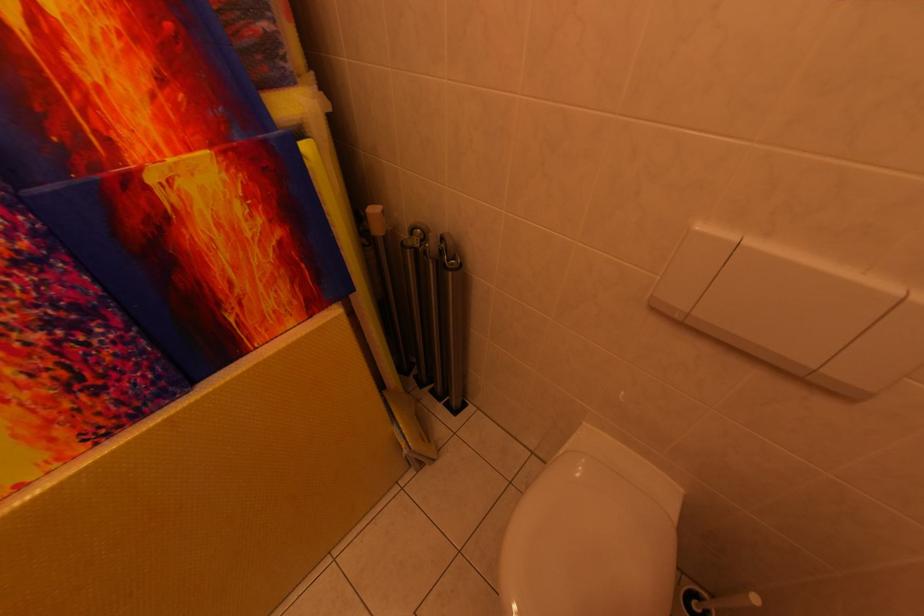
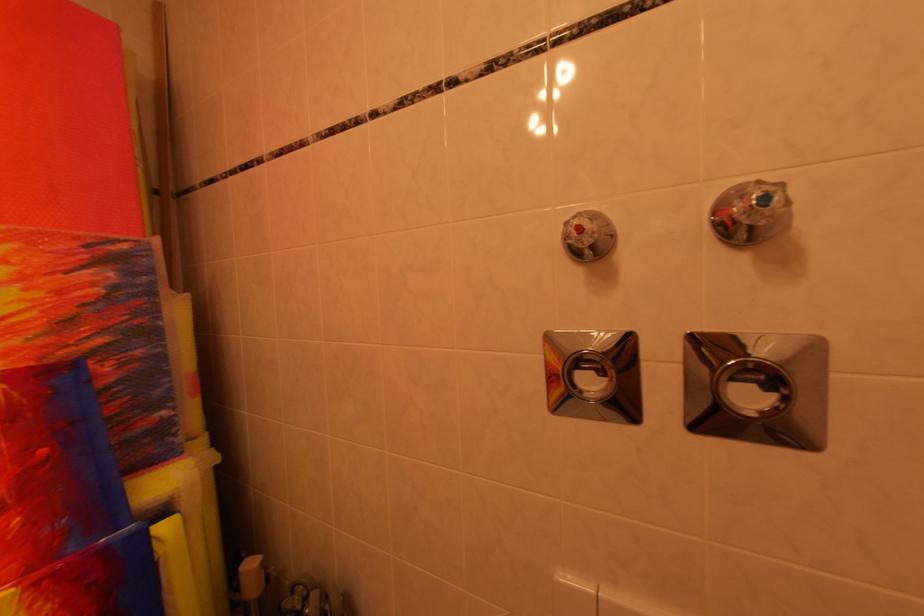
Based on the continuous images, in which direction is the camera rotating?

The rotation direction of the camera is right-up.